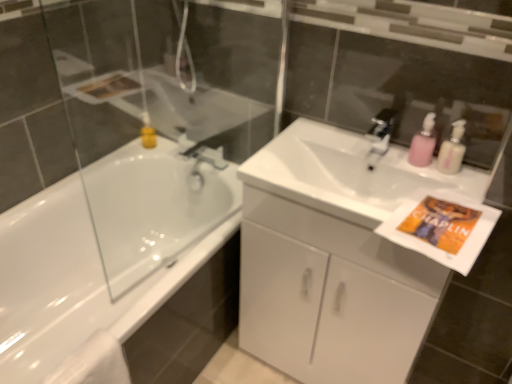
Question: Is silver metallic faucet at upper center facing towards pink plastic pump at upper right?

Choices:
 (A) yes
 (B) no

Answer: (B)

Question: Does silver metallic faucet at upper center have a greater width compared to pink plastic pump at upper right?

Choices:
 (A) yes
 (B) no

Answer: (A)

Question: From the image's perspective, is silver metallic faucet at upper center over pink plastic pump at upper right?

Choices:
 (A) yes
 (B) no

Answer: (A)

Question: Is silver metallic faucet at upper center not within pink plastic pump at upper right?

Choices:
 (A) yes
 (B) no

Answer: (A)

Question: Is silver metallic faucet at upper center positioned with its back to pink plastic pump at upper right?

Choices:
 (A) yes
 (B) no

Answer: (B)

Question: From a real-world perspective, does silver metallic faucet at upper center sit lower than pink plastic pump at upper right?

Choices:
 (A) yes
 (B) no

Answer: (A)

Question: From a real-world perspective, is pink plastic soap dispenser at upper right positioned over white matte towel at lower left based on gravity?

Choices:
 (A) yes
 (B) no

Answer: (A)

Question: Is pink plastic soap dispenser at upper right turned away from white matte towel at lower left?

Choices:
 (A) no
 (B) yes

Answer: (A)

Question: Is pink plastic soap dispenser at upper right taller than white matte towel at lower left?

Choices:
 (A) no
 (B) yes

Answer: (A)

Question: Could you tell me if pink plastic soap dispenser at upper right is facing white matte towel at lower left?

Choices:
 (A) yes
 (B) no

Answer: (B)

Question: Can you confirm if pink plastic soap dispenser at upper right is smaller than white matte towel at lower left?

Choices:
 (A) yes
 (B) no

Answer: (A)

Question: Considering the relative sizes of pink plastic soap dispenser at upper right and white matte towel at lower left in the image provided, is pink plastic soap dispenser at upper right shorter than white matte towel at lower left?

Choices:
 (A) yes
 (B) no

Answer: (A)

Question: Is white glossy cabinet at center located outside silver metallic faucet at upper center?

Choices:
 (A) no
 (B) yes

Answer: (B)